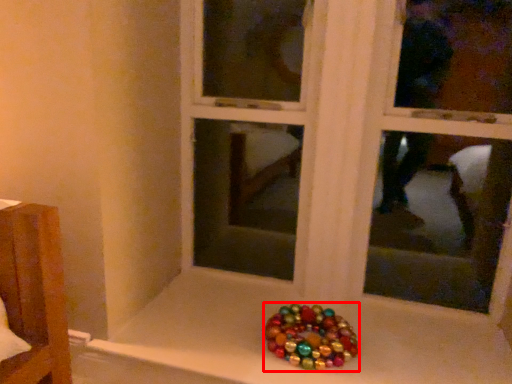
Question: In this image, where is glass bead (annotated by the red box) located relative to bay window?

Choices:
 (A) left
 (B) right

Answer: (A)